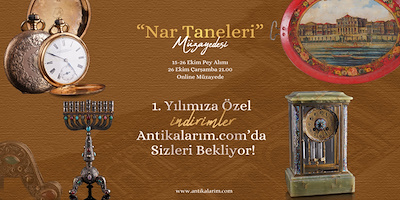
What are the coordinates of `old fashioned bookshelf clock` in the screenshot? It's located at (320, 127).